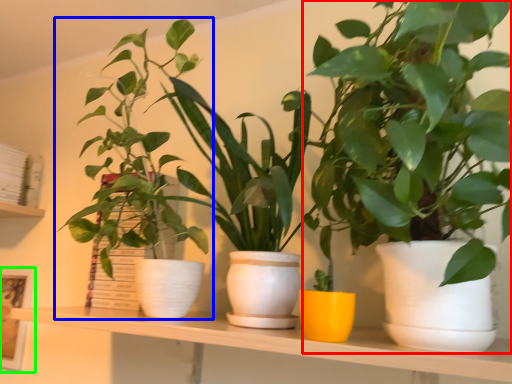
Question: Which is farther away from houseplant (highlighted by a red box)? houseplant (highlighted by a blue box) or picture frame (highlighted by a green box)?

Choices:
 (A) houseplant
 (B) picture frame

Answer: (B)